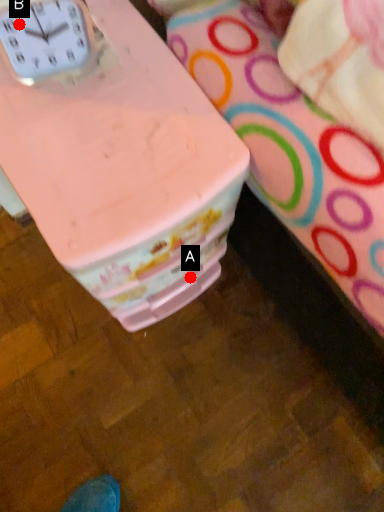
Question: Two points are circled on the image, labeled by A and B beside each circle. Which point appears closest to the camera in this image?

Choices:
 (A) A is closer
 (B) B is closer

Answer: (B)